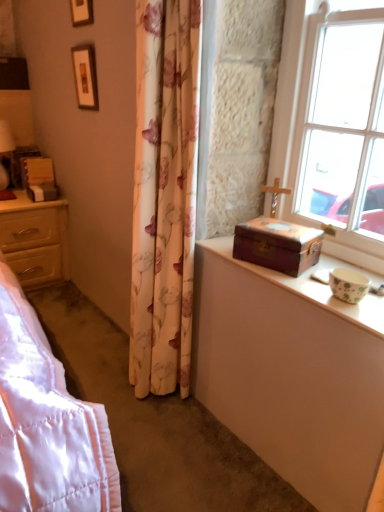
Identify the location of free space that is to the left of floral fabric curtain at center. (99, 384).